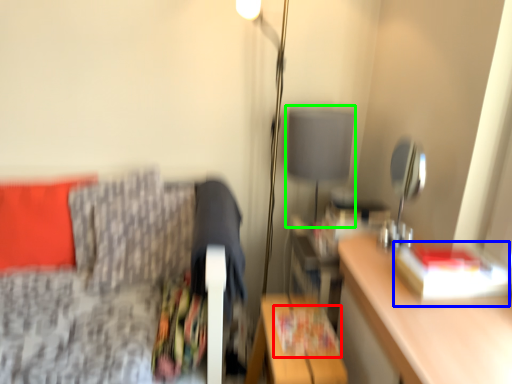
Question: Estimate the real-world distances between objects in this image. Which object is farther from magazine (highlighted by a red box), book (highlighted by a blue box) or table lamp (highlighted by a green box)?

Choices:
 (A) book
 (B) table lamp

Answer: (B)